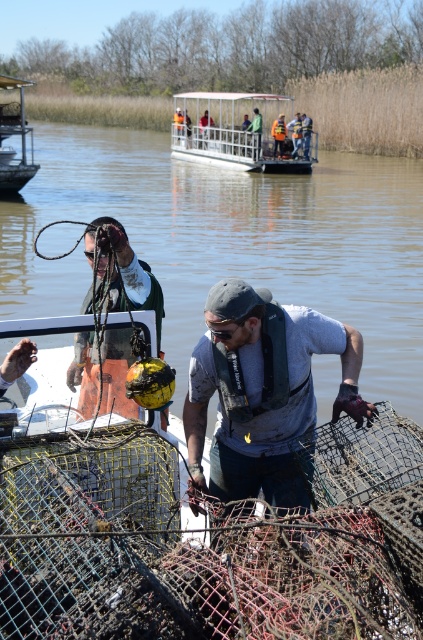
Who is positioned more to the right, brown mesh net at center or brushed metal boat at upper left?

From the viewer's perspective, brown mesh net at center appears more on the right side.

Which is behind, point (49, 308) or point (24, 104)?

Positioned behind is point (24, 104).

Where is `brown mesh net at center`? The image size is (423, 640). brown mesh net at center is located at coordinates (233, 241).

What do you see at coordinates (233, 241) in the screenshot?
I see `brown mesh net at center` at bounding box center [233, 241].

What are the coordinates of `brown mesh net at center` in the screenshot? It's located at point(233,241).

Can you confirm if brown mesh net at center is positioned to the left of orange life vest at center?

Correct, you'll find brown mesh net at center to the left of orange life vest at center.

Between brown mesh net at center and orange life vest at center, which one appears on the right side from the viewer's perspective?

orange life vest at center

Is point (299, 195) positioned in front of point (277, 138)?

Yes.

The image size is (423, 640). I want to click on brown mesh net at center, so click(x=233, y=241).